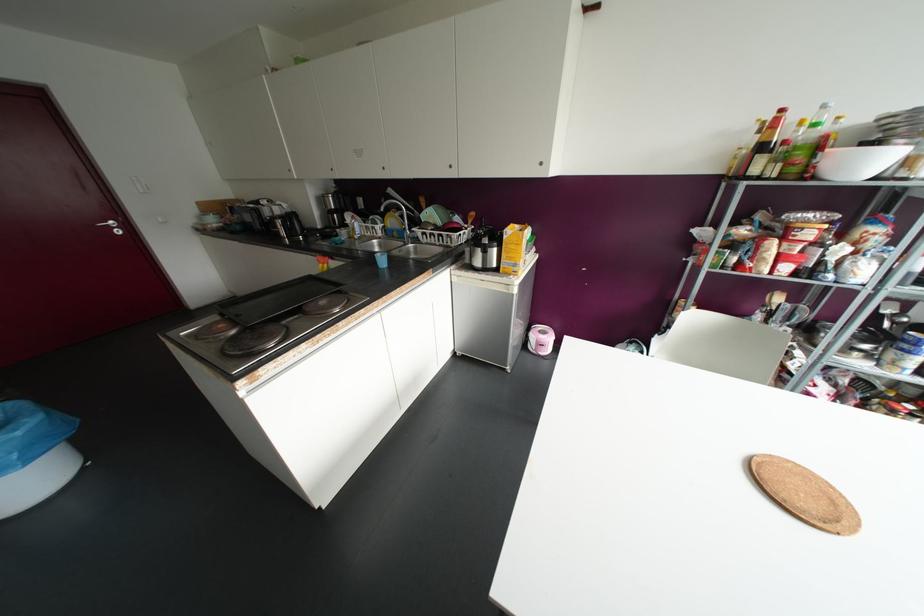
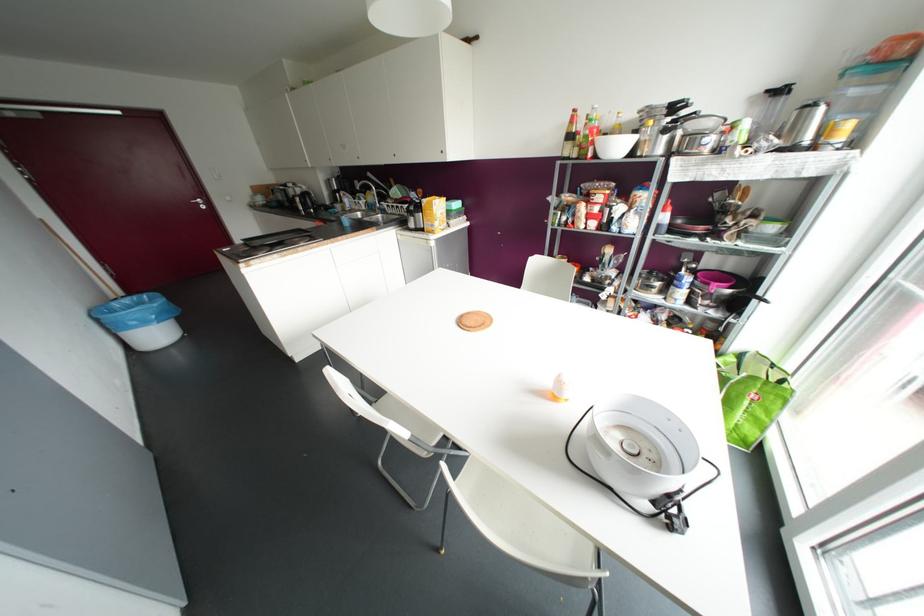
The point at (504, 236) is marked in the first image. Where is the corresponding point in the second image?

(421, 204)